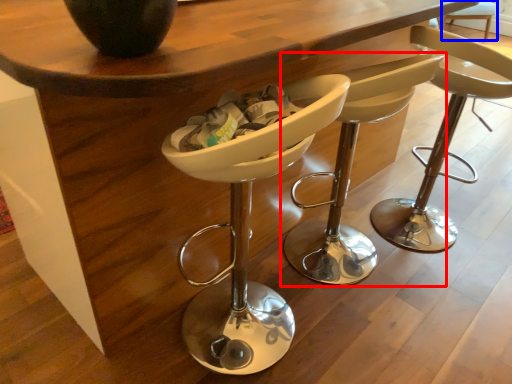
Question: Among these objects, which one is farthest to the camera, chair (highlighted by a red box) or bar stool (highlighted by a blue box)?

Choices:
 (A) chair
 (B) bar stool

Answer: (B)